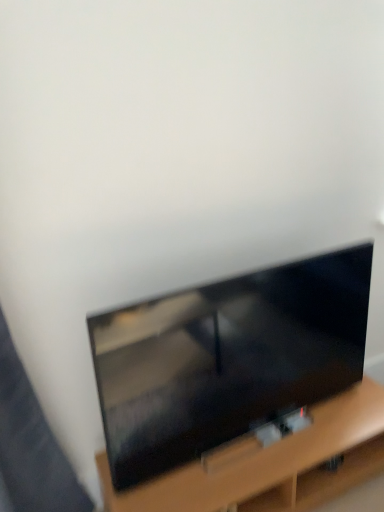
You are a GUI agent. You are given a task and a screenshot of the screen. Output one action in this format:
    pyautogui.click(x=<x>, y=<y>)
    Task: Click on the vacant space underneath matte black tv at center (from a real-world perspective)
    
    Given the screenshot: What is the action you would take?
    pyautogui.click(x=250, y=434)